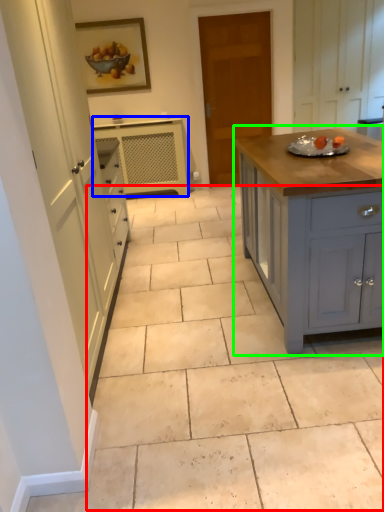
Question: Which object is positioned farthest from path (highlighted by a red box)? Select from cabinetry (highlighted by a blue box) and cabinetry (highlighted by a green box).

Choices:
 (A) cabinetry
 (B) cabinetry

Answer: (A)